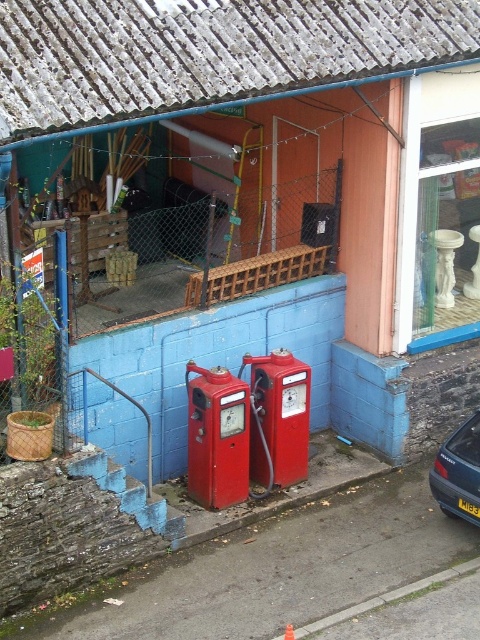
Question: Is blue metallic car at lower right thinner than black plastic license plate at lower center?

Choices:
 (A) yes
 (B) no

Answer: (B)

Question: Which of the following is the farthest from the observer?

Choices:
 (A) blue metallic car at lower right
 (B) black plastic license plate at lower center

Answer: (B)

Question: Does blue metallic car at lower right have a greater width compared to black plastic license plate at lower center?

Choices:
 (A) yes
 (B) no

Answer: (A)

Question: Can you confirm if blue metallic car at lower right is positioned to the left of black plastic license plate at lower center?

Choices:
 (A) no
 (B) yes

Answer: (B)

Question: Which object is closer to the camera taking this photo?

Choices:
 (A) blue metallic car at lower right
 (B) black plastic license plate at lower center

Answer: (A)